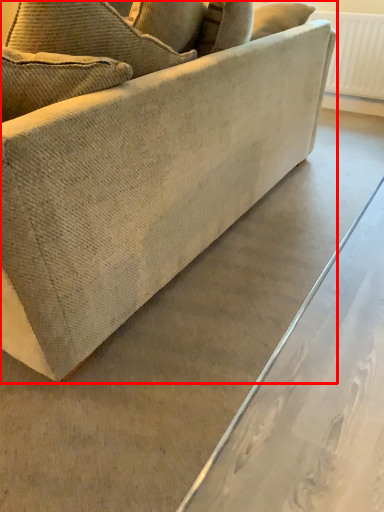
Question: Where is studio couch (annotated by the red box) located in relation to radiator in the image?

Choices:
 (A) left
 (B) right

Answer: (A)